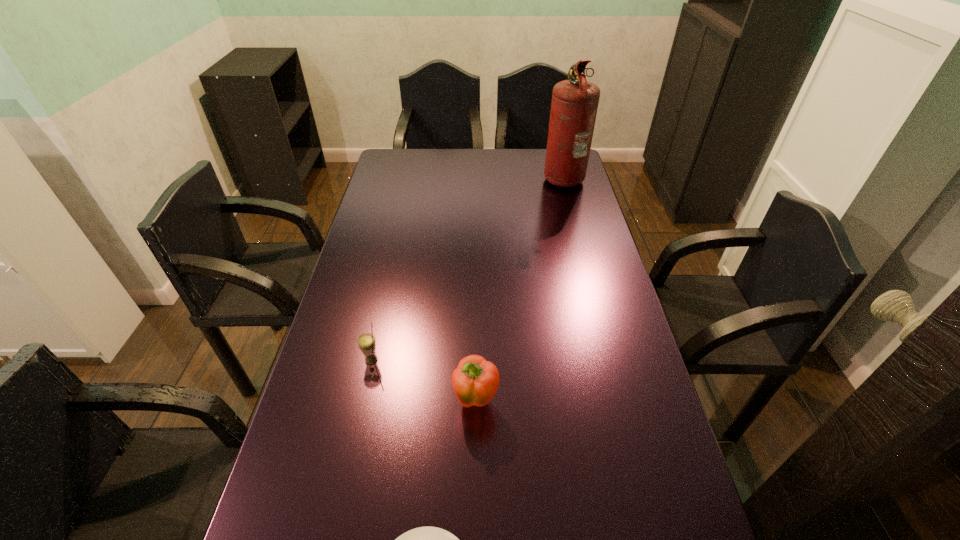
Locate an element on the screen. The image size is (960, 540). fire extinguisher is located at coordinates (574, 105).

In order to click on the rightmost object in this screenshot , I will do `click(574, 105)`.

Where is `the third farthest object`? The width and height of the screenshot is (960, 540). the third farthest object is located at coordinates (475, 381).

Where is `the second tallest object`? the second tallest object is located at coordinates (475, 381).

The image size is (960, 540). In order to click on the second farthest object in this screenshot , I will do `click(366, 342)`.

The width and height of the screenshot is (960, 540). What are the coordinates of `straw for drinking` in the screenshot? It's located at (366, 342).

Locate an element on the screen. vacant space located 0.160m at the front of the tallest object where the nozzle is aimed is located at coordinates (503, 177).

Image resolution: width=960 pixels, height=540 pixels. In order to click on free space located 0.380m at the front of the tallest object where the nozzle is aimed in this screenshot , I will do `click(449, 177)`.

You are a GUI agent. You are given a task and a screenshot of the screen. Output one action in this format:
    pyautogui.click(x=<x>, y=<y>)
    Task: Click on the vacant region located at the front of the tallest object where the nozzle is aimed
    The image size is (960, 540).
    Given the screenshot: What is the action you would take?
    pyautogui.click(x=493, y=177)

What are the coordinates of `vacant space located on the right of the third farthest object` in the screenshot? It's located at (557, 401).